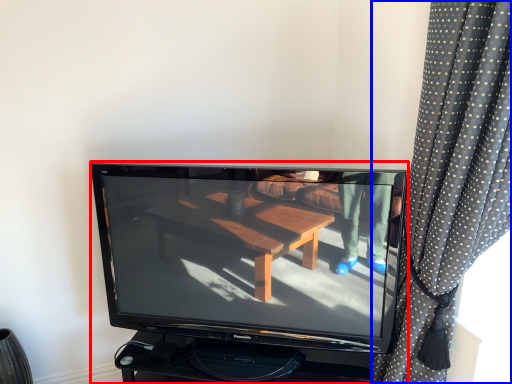
Question: Which of the following is the farthest to the observer, television (highlighted by a red box) or curtain (highlighted by a blue box)?

Choices:
 (A) television
 (B) curtain

Answer: (A)